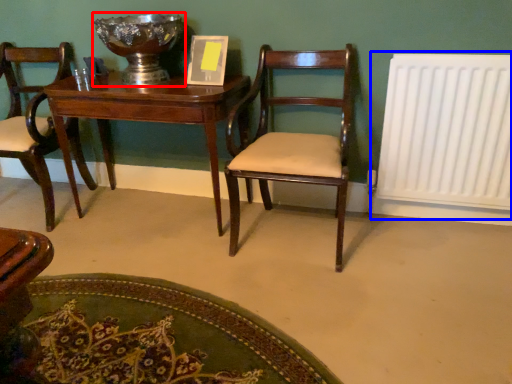
Question: Which point is closer to the camera, glass bowl (highlighted by a red box) or radiator (highlighted by a blue box)?

Choices:
 (A) glass bowl
 (B) radiator

Answer: (B)